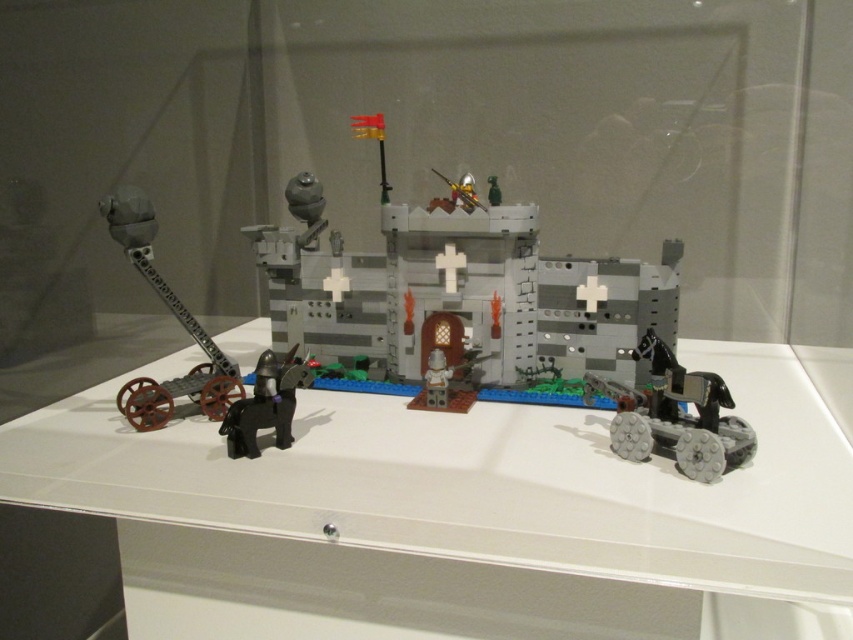
Question: Estimate the real-world distances between objects in this image. Which object is farther from the gray plastic castle at center?

Choices:
 (A) matte black horse at lower left
 (B) metallic gray tank at lower right
 (C) light gray plastic knight at center

Answer: (B)

Question: Can you confirm if metallic gray tank at lower right is thinner than metallic gold helmet at center?

Choices:
 (A) yes
 (B) no

Answer: (B)

Question: Is white plastic table at center behind metallic gold helmet at center?

Choices:
 (A) no
 (B) yes

Answer: (A)

Question: Is white plastic table at center smaller than light gray plastic knight at center?

Choices:
 (A) yes
 (B) no

Answer: (B)

Question: Which object appears farthest from the camera in this image?

Choices:
 (A) white plastic table at center
 (B) metallic gray tank at lower right
 (C) matte black horse at lower left
 (D) light gray plastic knight at center

Answer: (D)

Question: Which point appears closest to the camera in this image?

Choices:
 (A) pyautogui.click(x=463, y=184)
 (B) pyautogui.click(x=691, y=371)
 (C) pyautogui.click(x=625, y=518)
 (D) pyautogui.click(x=112, y=202)

Answer: (C)